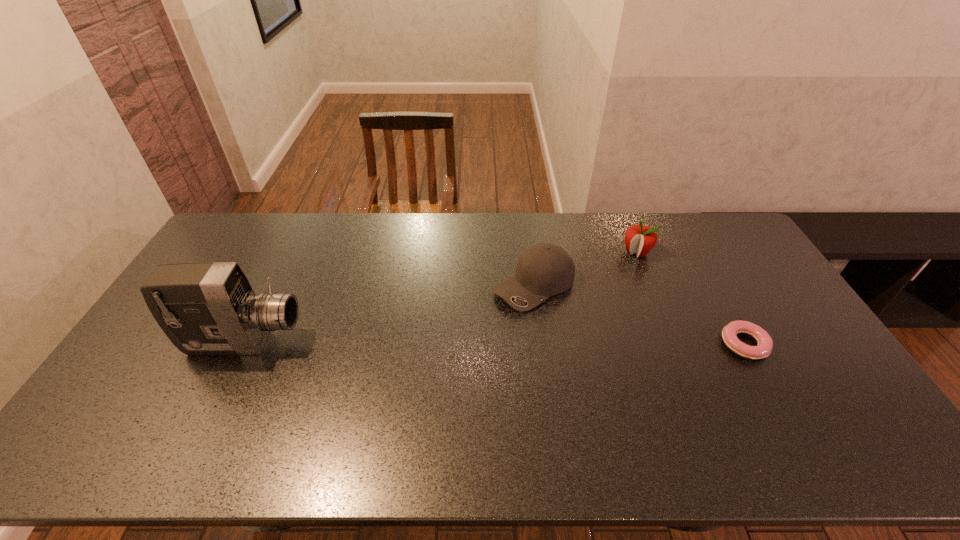
The height and width of the screenshot is (540, 960). Identify the location of vacant space positioned on the side where a bite is taken out of the third object from left to right. (577, 320).

This screenshot has width=960, height=540. I want to click on blank space located 0.060m on the front brim of the baseball cap, so click(x=491, y=315).

At what (x,y) coordinates should I click in order to perform the action: click on free region located 0.290m on the front brim of the baseball cap. Please return your answer as a coordinate pair (x, y). Looking at the image, I should click on (432, 356).

Image resolution: width=960 pixels, height=540 pixels. What are the coordinates of `vacant space situated 0.110m on the front brim of the baseball cap` in the screenshot? It's located at (479, 323).

Find the location of a particular element. This screenshot has width=960, height=540. object present at the far edge is located at coordinates (640, 239).

At what (x,y) coordinates should I click in order to perform the action: click on object that is at the left edge. Please return your answer as a coordinate pair (x, y). This screenshot has height=540, width=960. Looking at the image, I should click on (205, 308).

You are a GUI agent. You are given a task and a screenshot of the screen. Output one action in this format:
    pyautogui.click(x=<x>, y=<y>)
    Task: Click on the object located in the right edge section of the desktop
    
    Given the screenshot: What is the action you would take?
    pyautogui.click(x=764, y=347)

The width and height of the screenshot is (960, 540). What are the coordinates of `free space at the far edge of the desktop` in the screenshot? It's located at [366, 212].

Locate an element on the screen. The image size is (960, 540). blank area at the near edge is located at coordinates (500, 407).

You are a GUI agent. You are given a task and a screenshot of the screen. Output one action in this format:
    pyautogui.click(x=<x>, y=<y>)
    Task: Click on the free space at the right edge of the desktop
    
    Given the screenshot: What is the action you would take?
    pyautogui.click(x=808, y=380)